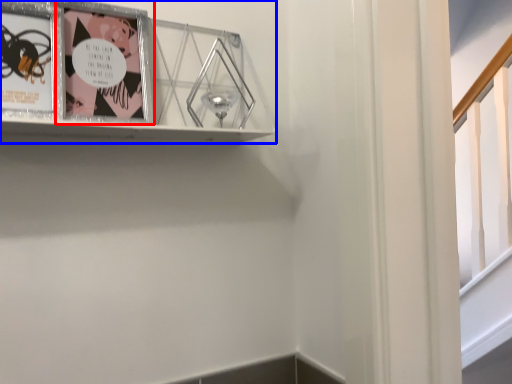
Question: Which of the following is the closest to the observer, picture frame (highlighted by a red box) or picture frame (highlighted by a blue box)?

Choices:
 (A) picture frame
 (B) picture frame

Answer: (B)